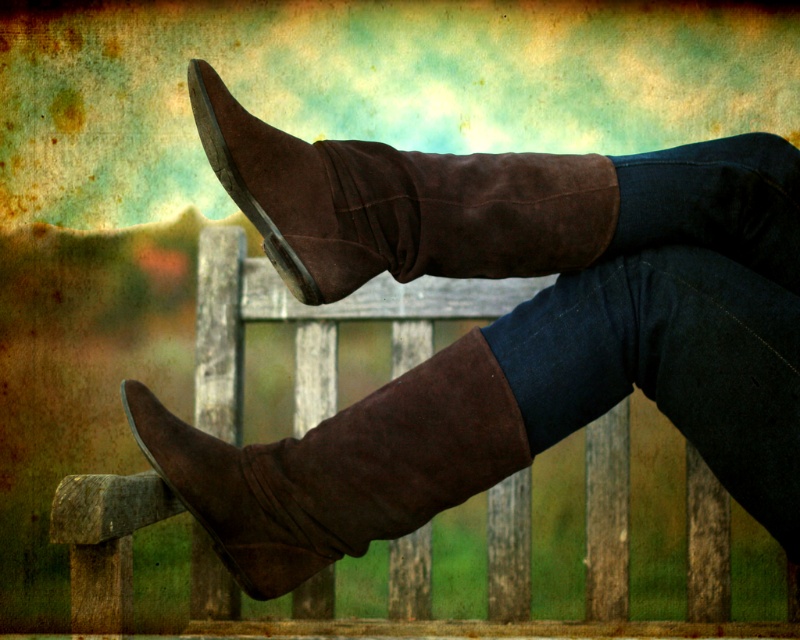
Which is in front, point (680, 401) or point (322, 241)?

Point (322, 241) is in front.

Is point (486, 232) farther from camera compared to point (216, 170)?

That is False.

Find the location of a particular element. suede boots at center is located at coordinates (504, 326).

Does suede boot at center have a larger size compared to suede brown boot at center?

No, suede boot at center is not bigger than suede brown boot at center.

Does suede boot at center appear under suede brown boot at center?

No.

This screenshot has width=800, height=640. Find the location of `suede boot at center`. suede boot at center is located at coordinates (400, 204).

In order to click on suede boot at center in this screenshot , I will do `click(400, 204)`.

What do you see at coordinates (504, 326) in the screenshot? I see `suede boots at center` at bounding box center [504, 326].

Is suede boots at center wider than suede brown boot at center?

Correct, the width of suede boots at center exceeds that of suede brown boot at center.

Is point (512, 323) farther from camera compared to point (308, 504)?

Yes, point (512, 323) is farther from viewer.

Where is `suede boots at center`? suede boots at center is located at coordinates (504, 326).